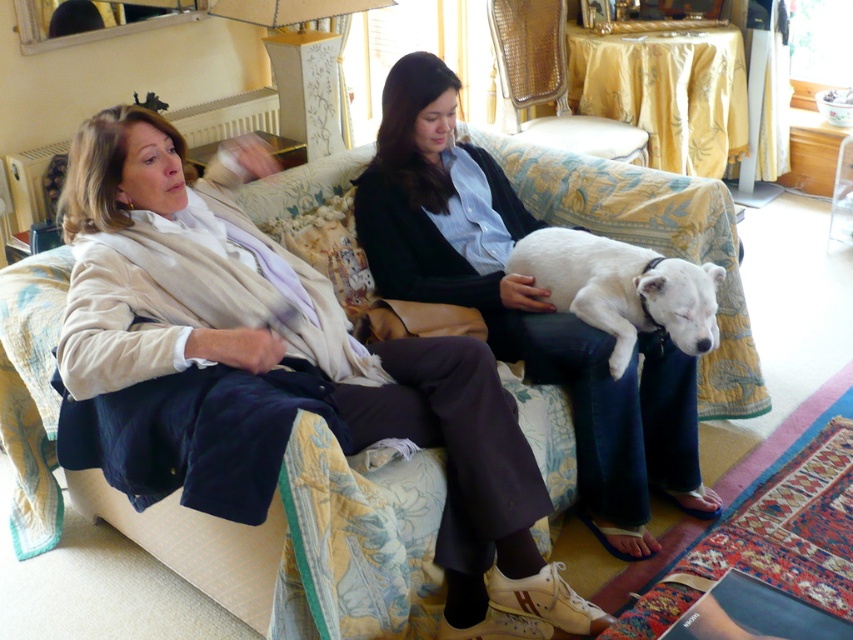
Question: Is matte beige sweater at left further to camera compared to woven cane chair at upper center?

Choices:
 (A) yes
 (B) no

Answer: (B)

Question: Which of the following is the closest to the observer?

Choices:
 (A) (550, 35)
 (B) (634, 314)
 (C) (605, 360)

Answer: (C)

Question: Does matte beige sweater at left appear under white fur dog at center?

Choices:
 (A) no
 (B) yes

Answer: (B)

Question: Which point appears farthest from the camera in this image?

Choices:
 (A) (138, 161)
 (B) (376, 240)
 (C) (587, 285)
 (D) (602, 131)

Answer: (D)

Question: Which object is farther from the camera taking this photo?

Choices:
 (A) matte black jacket at center
 (B) white fur dog at center

Answer: (A)

Question: Where is matte beige sweater at left located in relation to white fur dog at center in the image?

Choices:
 (A) left
 (B) right

Answer: (A)